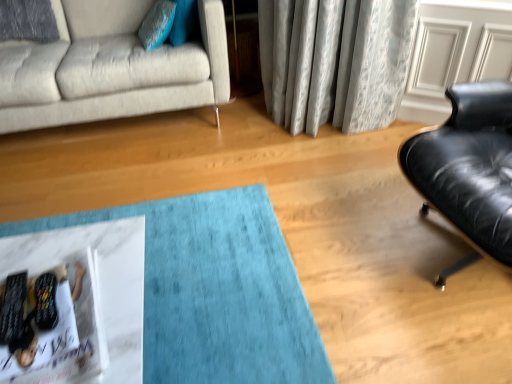
Image resolution: width=512 pixels, height=384 pixels. What are the coordinates of `white glossy magazine at lower left` in the screenshot? It's located at (71, 328).

Identify the location of teal fabric pillow at upper left. (157, 24).

Measure the distance between teal fabric pillow at upper left and camera.

teal fabric pillow at upper left and camera are 7.03 feet apart from each other.

The width and height of the screenshot is (512, 384). In order to click on white glossy magazine at lower left in this screenshot , I will do `click(71, 328)`.

I want to click on pillow behind the light gray fabric couch at upper left, so click(157, 24).

Does teal fabric pillow at upper left turn towards light gray fabric couch at upper left?

Yes, teal fabric pillow at upper left is facing light gray fabric couch at upper left.

Would you consider teal fabric pillow at upper left to be distant from light gray fabric couch at upper left?

Actually, teal fabric pillow at upper left and light gray fabric couch at upper left are a little close together.

Is light gray fabric couch at upper left in front of white glossy magazine at lower left?

No, it is not.

From the image's perspective, relative to white glossy magazine at lower left, is light gray fabric couch at upper left above or below?

light gray fabric couch at upper left is situated higher than white glossy magazine at lower left in the image.

How far apart are light gray fabric couch at upper left and white glossy magazine at lower left?

A distance of 4.52 feet exists between light gray fabric couch at upper left and white glossy magazine at lower left.

This screenshot has width=512, height=384. I want to click on studio couch above the white glossy magazine at lower left (from the image's perspective), so click(112, 69).

Which of these two, white glossy magazine at lower left or teal fabric pillow at upper left, is bigger?

With larger size is teal fabric pillow at upper left.

From the image's perspective, is white glossy magazine at lower left under teal fabric pillow at upper left?

Correct, white glossy magazine at lower left appears lower than teal fabric pillow at upper left in the image.

Where is `pillow that is behind the white glossy magazine at lower left`? The width and height of the screenshot is (512, 384). pillow that is behind the white glossy magazine at lower left is located at coordinates (157, 24).

Considering the relative positions of white glossy magazine at lower left and teal fabric pillow at upper left in the image provided, is white glossy magazine at lower left to the left of teal fabric pillow at upper left from the viewer's perspective?

No.

The image size is (512, 384). In order to click on pillow behind the white glossy magazine at lower left in this screenshot , I will do `click(157, 24)`.

From the image's perspective, is teal fabric pillow at upper left located beneath white glossy magazine at lower left?

No.

In the scene shown: Between teal fabric pillow at upper left and white glossy magazine at lower left, which one appears on the right side from the viewer's perspective?

From the viewer's perspective, white glossy magazine at lower left appears more on the right side.

Is teal fabric pillow at upper left aimed at white glossy magazine at lower left?

No, teal fabric pillow at upper left is not facing towards white glossy magazine at lower left.

What's the angular difference between light gray fabric couch at upper left and teal fabric pillow at upper left's facing directions?

There is a 73.3-degree angle between the facing directions of light gray fabric couch at upper left and teal fabric pillow at upper left.

Considering the relative positions of light gray fabric couch at upper left and teal fabric pillow at upper left in the image provided, is light gray fabric couch at upper left to the left of teal fabric pillow at upper left from the viewer's perspective?

Correct, you'll find light gray fabric couch at upper left to the left of teal fabric pillow at upper left.

Is light gray fabric couch at upper left inside the boundaries of teal fabric pillow at upper left, or outside?

light gray fabric couch at upper left is outside teal fabric pillow at upper left.

Are light gray fabric couch at upper left and teal fabric pillow at upper left located far from each other?

No.

Is white glossy magazine at lower left far from light gray fabric couch at upper left?

Yes.

Is point (72, 283) closer to viewer compared to point (5, 89)?

Yes, point (72, 283) is in front of point (5, 89).

Considering the sizes of white glossy magazine at lower left and light gray fabric couch at upper left in the image, is white glossy magazine at lower left wider or thinner than light gray fabric couch at upper left?

Clearly, white glossy magazine at lower left has less width compared to light gray fabric couch at upper left.

Does white glossy magazine at lower left have a greater height compared to light gray fabric couch at upper left?

No, white glossy magazine at lower left is not taller than light gray fabric couch at upper left.

At what (x,y) coordinates should I click in order to perform the action: click on studio couch to the left of teal fabric pillow at upper left. Please return your answer as a coordinate pair (x, y). Looking at the image, I should click on (112, 69).

I want to click on magazine below the light gray fabric couch at upper left (from a real-world perspective), so click(x=71, y=328).

Estimate the real-world distances between objects in this image. Which object is closer to white glossy magazine at lower left, light gray fabric couch at upper left or teal fabric pillow at upper left?

Among the two, light gray fabric couch at upper left is located nearer to white glossy magazine at lower left.

From the image, which object appears to be farther from teal fabric pillow at upper left, white glossy magazine at lower left or light gray fabric couch at upper left?

white glossy magazine at lower left lies further to teal fabric pillow at upper left than the other object.

Which object lies further to the anchor point light gray fabric couch at upper left, teal fabric pillow at upper left or white glossy magazine at lower left?

The object further to light gray fabric couch at upper left is white glossy magazine at lower left.

From the image, which object appears to be farther from teal fabric pillow at upper left, light gray fabric couch at upper left or white glossy magazine at lower left?

white glossy magazine at lower left lies further to teal fabric pillow at upper left than the other object.

Estimate the real-world distances between objects in this image. Which object is closer to light gray fabric couch at upper left, white glossy magazine at lower left or teal fabric pillow at upper left?

The object closer to light gray fabric couch at upper left is teal fabric pillow at upper left.

Estimate the real-world distances between objects in this image. Which object is further from white glossy magazine at lower left, teal fabric pillow at upper left or light gray fabric couch at upper left?

teal fabric pillow at upper left is further to white glossy magazine at lower left.

At what (x,y) coordinates should I click in order to perform the action: click on studio couch between teal fabric pillow at upper left and white glossy magazine at lower left in the up-down direction. Please return your answer as a coordinate pair (x, y). This screenshot has width=512, height=384. Looking at the image, I should click on (112, 69).